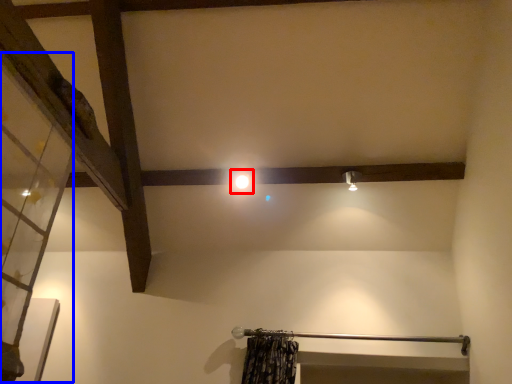
Question: Which of the following is the farthest to the observer, light (highlighted by a red box) or glass door (highlighted by a blue box)?

Choices:
 (A) light
 (B) glass door

Answer: (A)